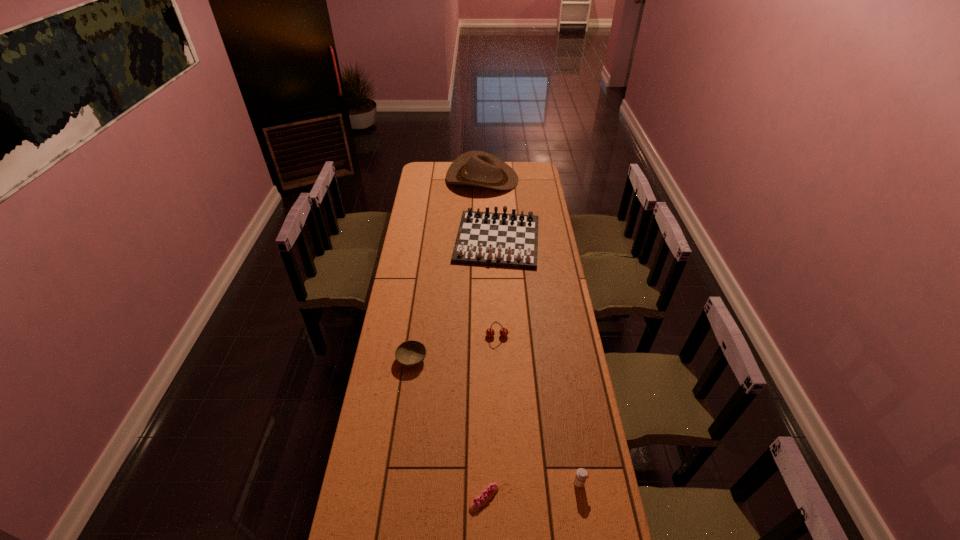
At what (x,y) coordinates should I click in order to perform the action: click on the farthest object. Please return your answer as a coordinate pair (x, y). Looking at the image, I should click on (475, 168).

At what (x,y) coordinates should I click in order to perform the action: click on the tallest object. Please return your answer as a coordinate pair (x, y). This screenshot has width=960, height=540. Looking at the image, I should click on (475, 168).

Find the location of a particular element. the fifth nearest object is located at coordinates (485, 238).

The width and height of the screenshot is (960, 540). I want to click on the third farthest object, so click(x=490, y=332).

Locate an element on the screen. This screenshot has width=960, height=540. medicine is located at coordinates (581, 475).

The height and width of the screenshot is (540, 960). Find the location of `the fifth tallest object`. the fifth tallest object is located at coordinates (410, 353).

Identify the location of the fourth farthest object. (410, 353).

Identify the location of eclair. (486, 494).

Locate an element on the screen. Image resolution: width=960 pixels, height=540 pixels. vacant space located with a star on the front of the farthest object is located at coordinates (432, 179).

Identify the location of vacant space situated 0.170m with a star on the front of the farthest object. The width and height of the screenshot is (960, 540). (420, 179).